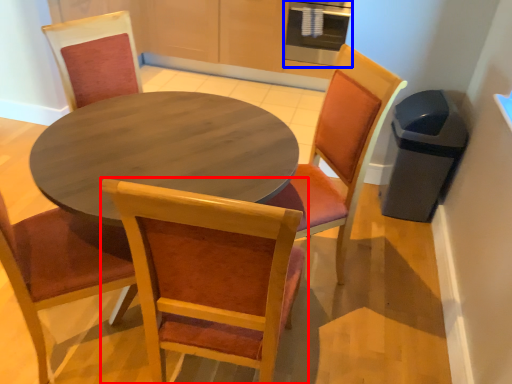
Question: Among these objects, which one is nearest to the camera, chair (highlighted by a red box) or appliance (highlighted by a blue box)?

Choices:
 (A) chair
 (B) appliance

Answer: (A)